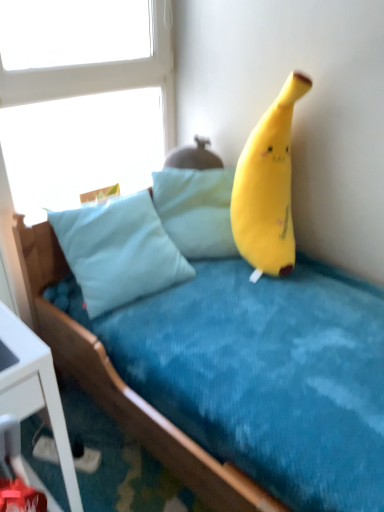
Question: Is light blue fabric pillow at center to the left or to the right of soft yellow plush at upper right in the image?

Choices:
 (A) right
 (B) left

Answer: (B)

Question: Do you think light blue fabric pillow at center is within soft yellow plush at upper right, or outside of it?

Choices:
 (A) inside
 (B) outside

Answer: (B)

Question: Estimate the real-world distances between objects in this image. Which object is farther from the soft blue fabric bed at upper right?

Choices:
 (A) white glass window at upper left
 (B) light blue fabric pillow at center
 (C) soft yellow plush at upper right

Answer: (A)

Question: Estimate the real-world distances between objects in this image. Which object is closer to the white glass window at upper left?

Choices:
 (A) soft yellow plush at upper right
 (B) light blue fabric pillow at center
 (C) soft blue fabric bed at upper right

Answer: (B)